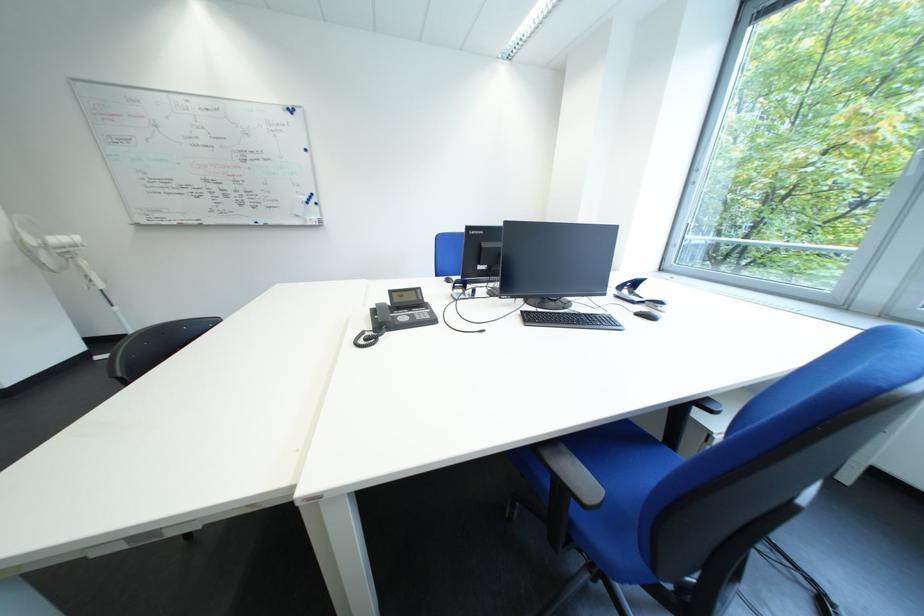
Find where to lift the telephone receiver. Please return your answer as a coordinate pair (x, y).

(383, 315)